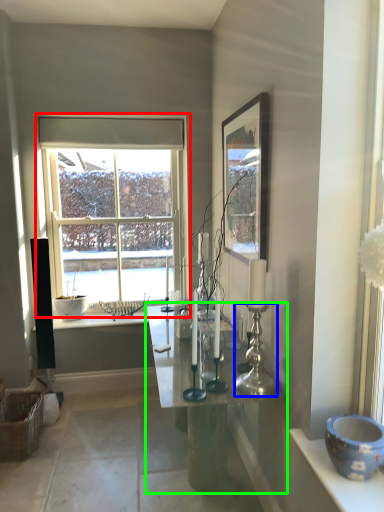
Question: Estimate the real-world distances between objects in this image. Which object is farther from window (highlighted by a red box), candle holder (highlighted by a blue box) or table (highlighted by a green box)?

Choices:
 (A) candle holder
 (B) table

Answer: (A)